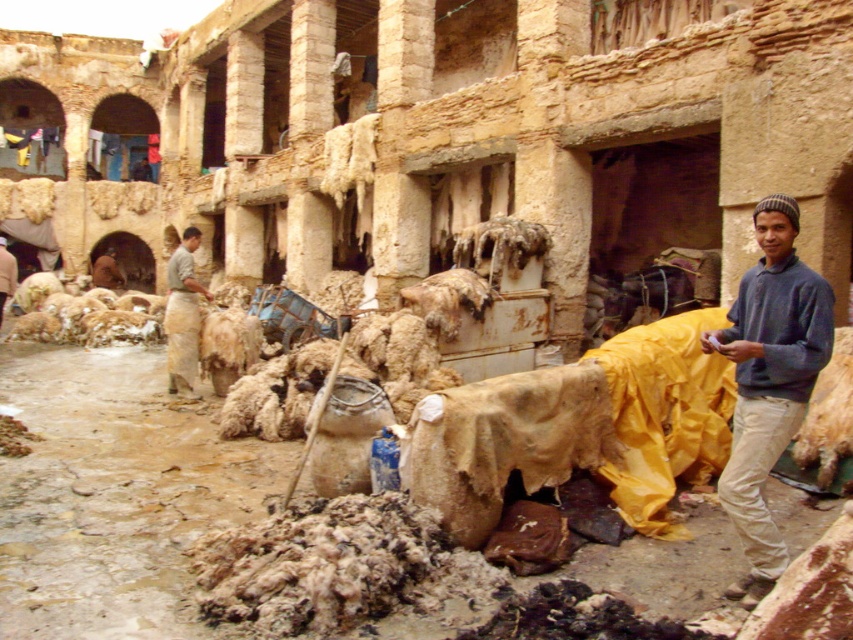
Question: Can you confirm if light brown fabric apron at center is positioned above brown woolen sweater at center?

Choices:
 (A) no
 (B) yes

Answer: (A)

Question: Does dark blue sweater at right have a larger size compared to brown leather jacket at center?

Choices:
 (A) yes
 (B) no

Answer: (A)

Question: Is light brown fabric apron at center to the right of brown woolen sweater at center from the viewer's perspective?

Choices:
 (A) no
 (B) yes

Answer: (B)

Question: Which is farther from the light brown fabric apron at center?

Choices:
 (A) brown woolen sweater at center
 (B) dark blue sweater at right

Answer: (B)

Question: Which object is the farthest from the light brown fabric apron at center?

Choices:
 (A) brown woolen sweater at center
 (B) dark blue sweater at right
 (C) brown leather jacket at center

Answer: (C)

Question: Which of these objects is positioned farthest from the brown woolen sweater at center?

Choices:
 (A) dark blue sweater at right
 (B) brown leather jacket at center
 (C) light brown fabric apron at center

Answer: (A)